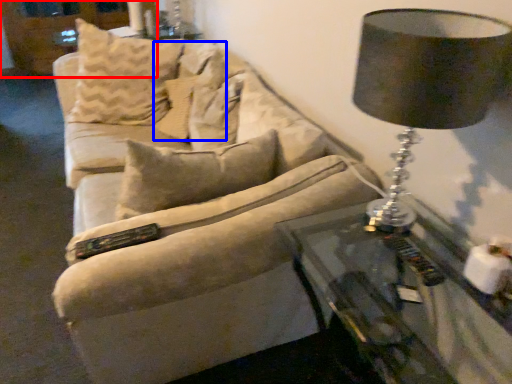
Question: Which object is further to the camera taking this photo, dresser (highlighted by a red box) or pillow (highlighted by a blue box)?

Choices:
 (A) dresser
 (B) pillow

Answer: (A)